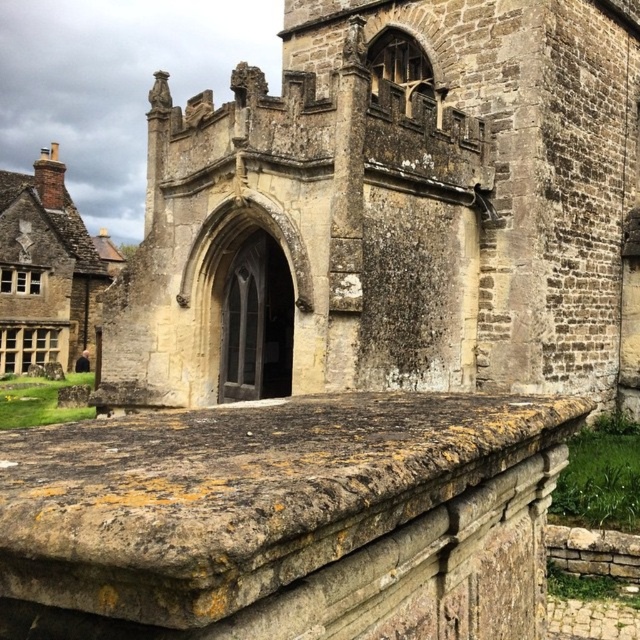
Question: Which of the following is the closest to the observer?

Choices:
 (A) (26, 266)
 (B) (208, 525)

Answer: (B)

Question: Is stone church at center smaller than weathered stone ledge at center?

Choices:
 (A) yes
 (B) no

Answer: (B)

Question: Is stone church at center above stone chimney at left?

Choices:
 (A) yes
 (B) no

Answer: (B)

Question: Is stone church at center further to the viewer compared to weathered stone ledge at center?

Choices:
 (A) no
 (B) yes

Answer: (B)

Question: Which object is the farthest from the stone church at center?

Choices:
 (A) weathered stone ledge at center
 (B) stone chimney at left

Answer: (B)

Question: Which point is closer to the camera taking this photo?

Choices:
 (A) (61, 216)
 (B) (157, 378)
 (C) (368, 529)

Answer: (C)